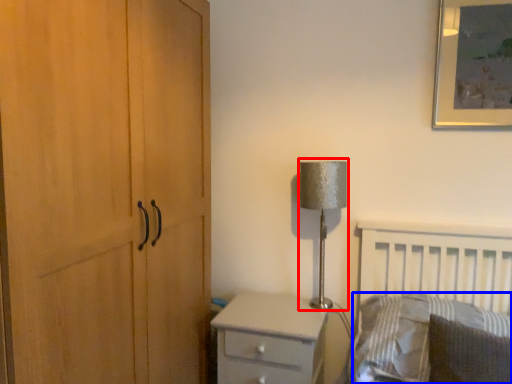
Question: Which object appears closest to the camera in this image, table lamp (highlighted by a red box) or pillow (highlighted by a blue box)?

Choices:
 (A) table lamp
 (B) pillow

Answer: (B)